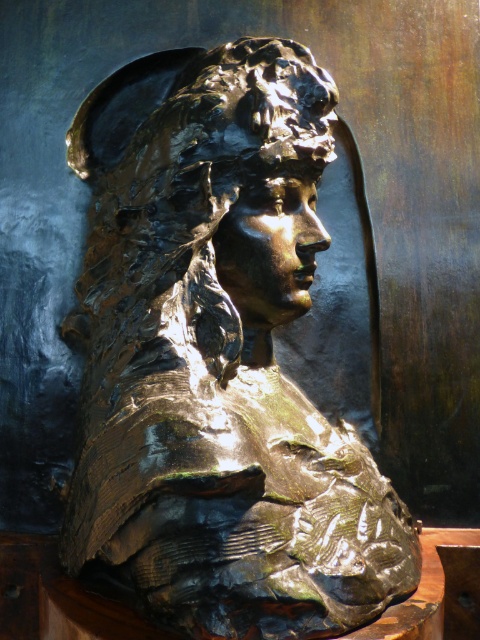
Question: Is bronze bust at center further to the viewer compared to bronze sculpture at center?

Choices:
 (A) no
 (B) yes

Answer: (A)

Question: Which point is farther to the camera?

Choices:
 (A) (204, 113)
 (B) (97, 257)

Answer: (B)

Question: Is bronze bust at center wider than bronze sculpture at center?

Choices:
 (A) yes
 (B) no

Answer: (A)

Question: Does bronze bust at center appear on the right side of bronze sculpture at center?

Choices:
 (A) yes
 (B) no

Answer: (A)

Question: Among these points, which one is farthest from the camera?

Choices:
 (A) (415, 557)
 (B) (130, 221)

Answer: (B)